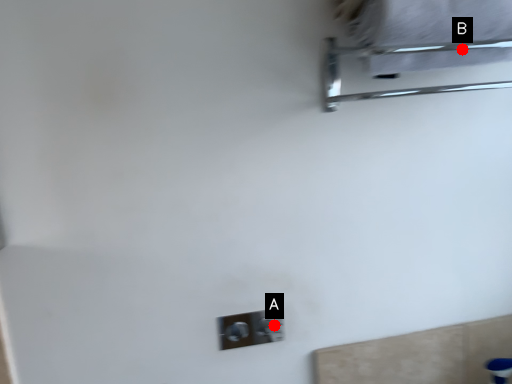
Question: Two points are circled on the image, labeled by A and B beside each circle. Which point is farther from the camera taking this photo?

Choices:
 (A) A is further
 (B) B is further

Answer: (A)